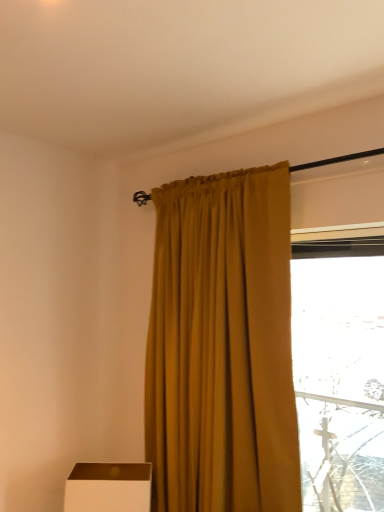
The height and width of the screenshot is (512, 384). What do you see at coordinates (222, 346) in the screenshot? I see `mustard fabric curtain at center` at bounding box center [222, 346].

Locate an element on the screen. mustard fabric curtain at center is located at coordinates (222, 346).

Image resolution: width=384 pixels, height=512 pixels. I want to click on white matte box at lower left, so click(108, 487).

Measure the distance between white matte box at lower left and camera.

white matte box at lower left is 1.66 meters from camera.

Describe the element at coordinates (108, 487) in the screenshot. I see `white matte box at lower left` at that location.

At what (x,y) coordinates should I click in order to perform the action: click on mustard fabric curtain at center. Please return your answer as a coordinate pair (x, y). Image resolution: width=384 pixels, height=512 pixels. Looking at the image, I should click on (222, 346).

Which is more to the right, white matte box at lower left or mustard fabric curtain at center?

mustard fabric curtain at center is more to the right.

Considering the positions of objects white matte box at lower left and mustard fabric curtain at center in the image provided, who is in front, white matte box at lower left or mustard fabric curtain at center?

mustard fabric curtain at center is closer to the camera.

Is point (123, 487) positioned in front of point (270, 408)?

No.

From the image's perspective, is white matte box at lower left below mustard fabric curtain at center?

Indeed, from the image's perspective, white matte box at lower left is shown beneath mustard fabric curtain at center.

From a real-world perspective, is white matte box at lower left on mustard fabric curtain at center?

Incorrect, from a real-world perspective, white matte box at lower left is lower than mustard fabric curtain at center.

Which object is wider, white matte box at lower left or mustard fabric curtain at center?

With larger width is white matte box at lower left.

Who is shorter, white matte box at lower left or mustard fabric curtain at center?

white matte box at lower left is shorter.

Considering the relative sizes of white matte box at lower left and mustard fabric curtain at center in the image provided, is white matte box at lower left bigger than mustard fabric curtain at center?

Incorrect, white matte box at lower left is not larger than mustard fabric curtain at center.

Is white matte box at lower left spatially inside mustard fabric curtain at center, or outside of it?

white matte box at lower left is spatially situated outside mustard fabric curtain at center.

Does white matte box at lower left touch mustard fabric curtain at center?

No, white matte box at lower left is not next to mustard fabric curtain at center.

Does white matte box at lower left turn towards mustard fabric curtain at center?

No, white matte box at lower left does not turn towards mustard fabric curtain at center.

How distant is white matte box at lower left from mustard fabric curtain at center?

white matte box at lower left is 20.10 inches away from mustard fabric curtain at center.

Locate an element on the screen. Image resolution: width=384 pixels, height=512 pixels. furniture below the mustard fabric curtain at center (from a real-world perspective) is located at coordinates (108, 487).

Which is more to the left, mustard fabric curtain at center or white matte box at lower left?

From the viewer's perspective, white matte box at lower left appears more on the left side.

Is mustard fabric curtain at center positioned before white matte box at lower left?

Yes, mustard fabric curtain at center is closer to the camera.

Is point (202, 347) closer or farther from the camera than point (132, 505)?

Point (202, 347) is positioned farther from the camera compared to point (132, 505).

From the image's perspective, does mustard fabric curtain at center appear lower than white matte box at lower left?

No, from the image's perspective, mustard fabric curtain at center is not beneath white matte box at lower left.

From a real-world perspective, is mustard fabric curtain at center physically located above or below white matte box at lower left?

From a real-world perspective, mustard fabric curtain at center is physically above white matte box at lower left.

Which of these two, mustard fabric curtain at center or white matte box at lower left, is wider?

white matte box at lower left is wider.

Which of these two, mustard fabric curtain at center or white matte box at lower left, stands shorter?

white matte box at lower left.

Does mustard fabric curtain at center have a smaller size compared to white matte box at lower left?

No.

Does mustard fabric curtain at center contain white matte box at lower left?

No, mustard fabric curtain at center does not contain white matte box at lower left.

Is mustard fabric curtain at center far away from white matte box at lower left?

No, mustard fabric curtain at center is in close proximity to white matte box at lower left.

Is white matte box at lower left at the back of mustard fabric curtain at center?

mustard fabric curtain at center does not have its back to white matte box at lower left.

At what (x,y) coordinates should I click in order to perform the action: click on curtain above the white matte box at lower left (from the image's perspective). Please return your answer as a coordinate pair (x, y). Image resolution: width=384 pixels, height=512 pixels. Looking at the image, I should click on (222, 346).

There is a white matte box at lower left. At what (x,y) coordinates should I click in order to perform the action: click on curtain above it (from a real-world perspective). Please return your answer as a coordinate pair (x, y). The width and height of the screenshot is (384, 512). Looking at the image, I should click on (222, 346).

Where is `furniture that appears below the mustard fabric curtain at center (from the image's perspective)`? The height and width of the screenshot is (512, 384). furniture that appears below the mustard fabric curtain at center (from the image's perspective) is located at coordinates (108, 487).